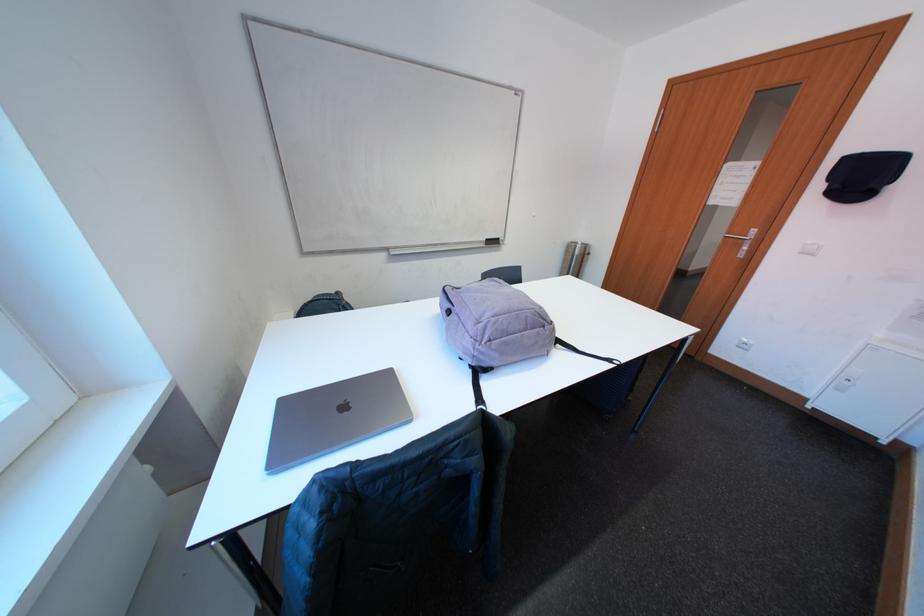
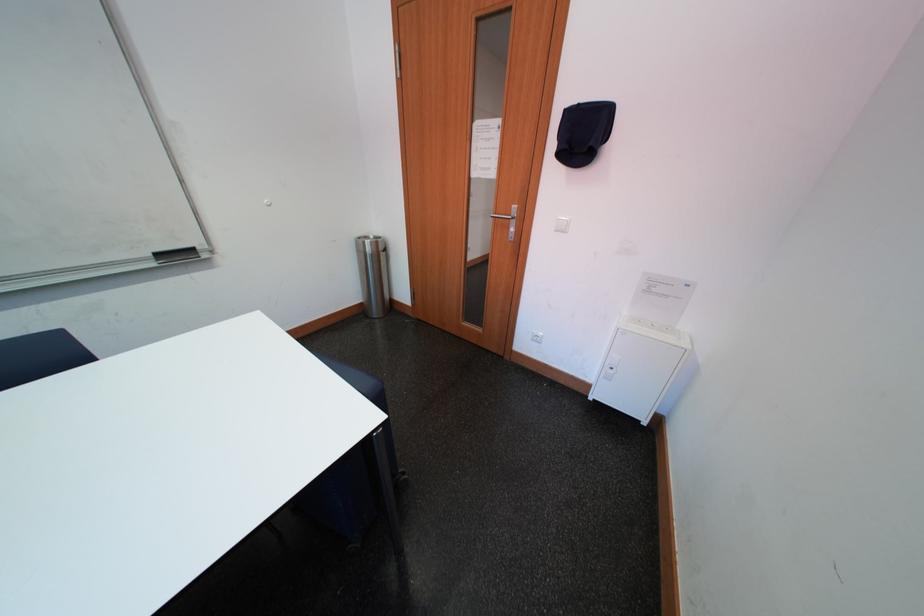
The point at (872, 182) is marked in the first image. Where is the corresponding point in the second image?

(593, 140)